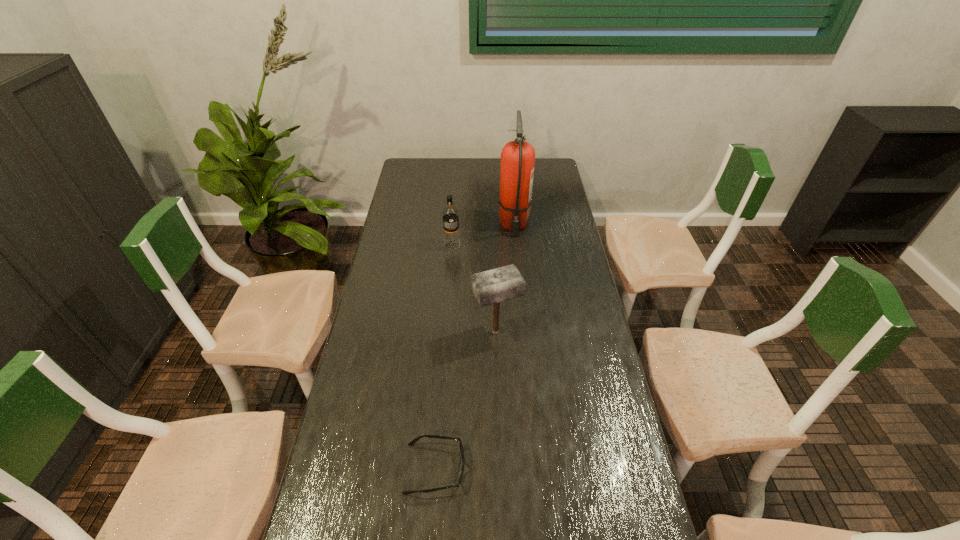
The width and height of the screenshot is (960, 540). I want to click on vacant space at the far edge, so click(439, 177).

This screenshot has width=960, height=540. Find the location of `vacant position at the left edge of the desktop`. vacant position at the left edge of the desktop is located at coordinates [x=409, y=208].

In the image, there is a desktop. Where is `free space at the right edge`? The height and width of the screenshot is (540, 960). free space at the right edge is located at coordinates (617, 539).

In the image, there is a desktop. Where is `vacant space at the far left corner`? The height and width of the screenshot is (540, 960). vacant space at the far left corner is located at coordinates (415, 166).

I want to click on free space between the nearest object and the tallest object, so click(x=474, y=347).

Image resolution: width=960 pixels, height=540 pixels. I want to click on vacant area that lies between the vodka and the spectacles, so point(444,356).

Find the location of `free area in between the shortest object and the vodka`. free area in between the shortest object and the vodka is located at coordinates (444, 356).

You are a GUI agent. You are given a task and a screenshot of the screen. Output one action in this format:
    pyautogui.click(x=<x>, y=<y>)
    Task: Click on the free space that is in between the third shortest object and the shortest object
    This screenshot has height=540, width=960.
    Given the screenshot: What is the action you would take?
    pyautogui.click(x=466, y=400)

Locate which object is the second closest to the nearest object. Please provide its 2D coordinates. Your answer should be formatted as a tuple, i.e. [(x, y)], where the tuple contains the x and y coordinates of a point satisfying the conditions above.

[(451, 240)]

Point out which object is positioned as the second nearest to the fire extinguisher. Please provide its 2D coordinates. Your answer should be formatted as a tuple, i.e. [(x, y)], where the tuple contains the x and y coordinates of a point satisfying the conditions above.

[(490, 287)]